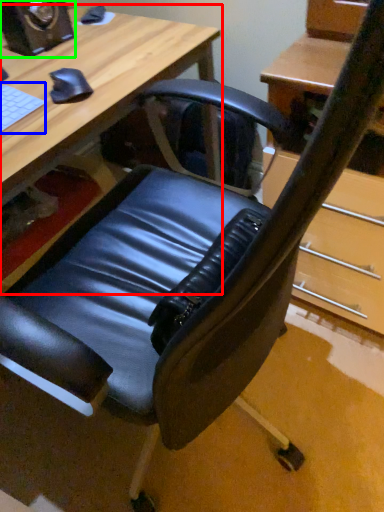
Question: Based on their relative distances, which object is nearer to desk (highlighted by a red box)? Choose from laptop keyboard (highlighted by a blue box) and speaker (highlighted by a green box).

Choices:
 (A) laptop keyboard
 (B) speaker

Answer: (B)